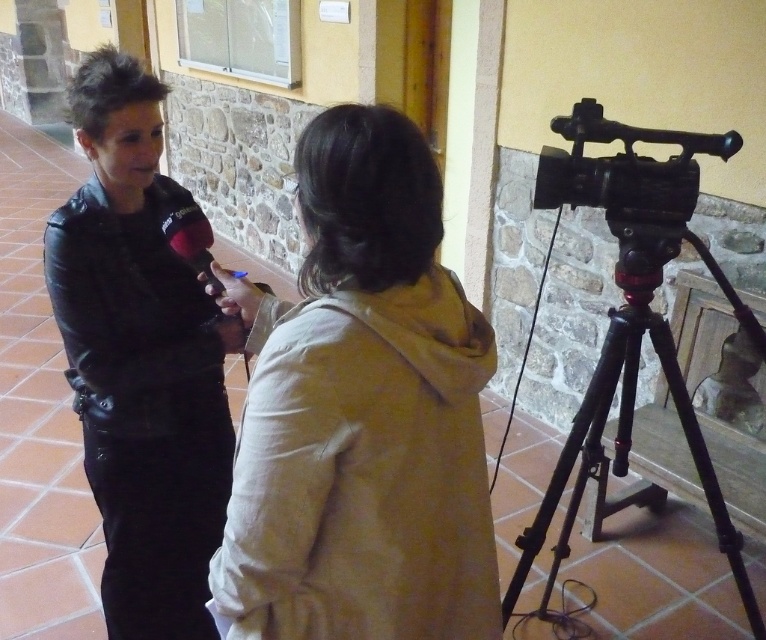
Is point (440, 410) positioned after point (691, 451)?

That is False.

Between beige cotton hoodie at center and black metal tripod at right, which one is positioned higher?

beige cotton hoodie at center is higher up.

Locate an element on the screen. beige cotton hoodie at center is located at coordinates (362, 412).

Does matte black jacket at left have a lesser height compared to black metal tripod at right?

No.

Who is more forward, [142,637] or [701,444]?

Point [701,444]

The width and height of the screenshot is (766, 640). I want to click on matte black jacket at left, so click(141, 358).

Is beige cotton hoodie at center shorter than matte black jacket at left?

Correct, beige cotton hoodie at center is not as tall as matte black jacket at left.

Between beige cotton hoodie at center and matte black jacket at left, which one has less height?

beige cotton hoodie at center is shorter.

Does point (345, 230) lie behind point (172, 324)?

That is False.

Find the location of a particular element. The width and height of the screenshot is (766, 640). beige cotton hoodie at center is located at coordinates (362, 412).